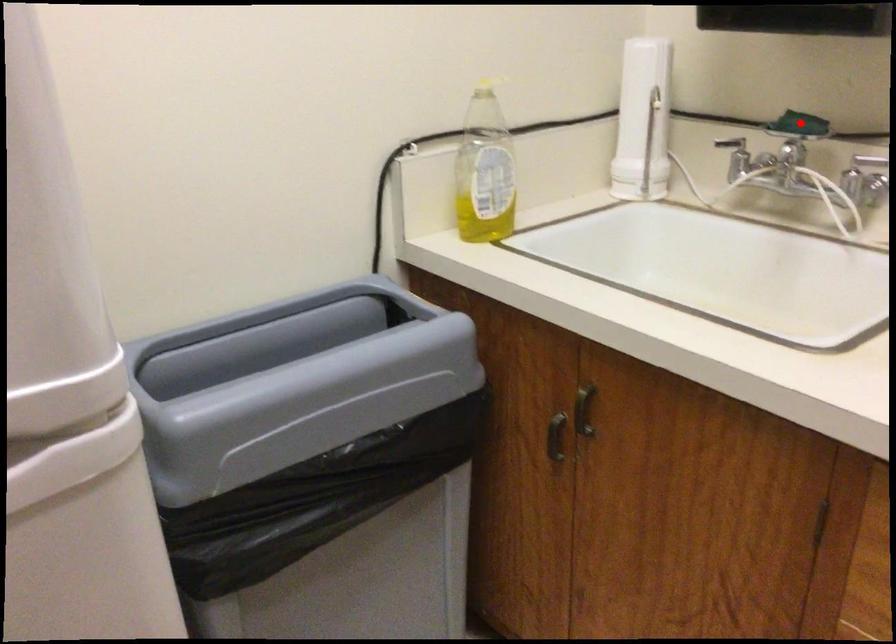
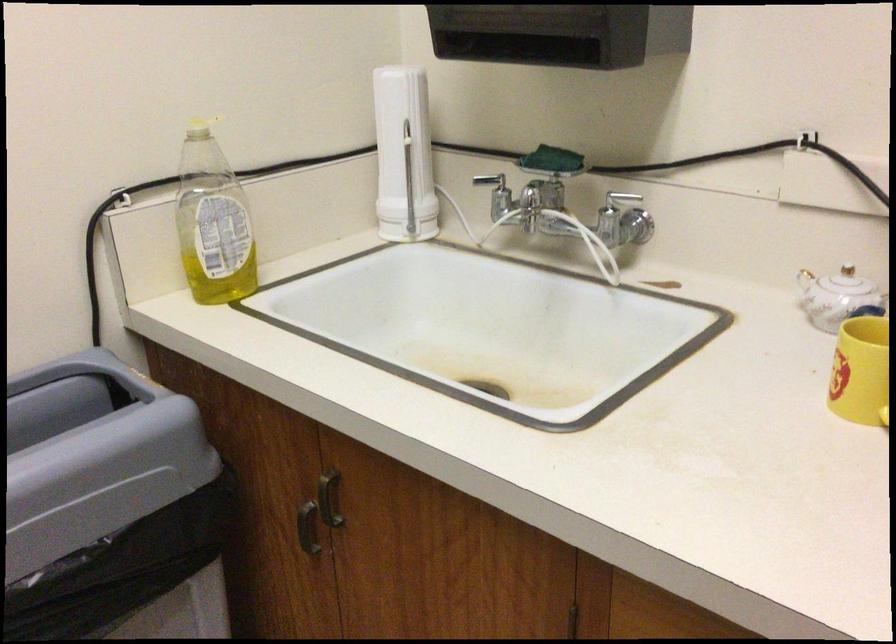
Locate, in the second image, the point that corresponds to the highlighted location in the first image.

(552, 160)